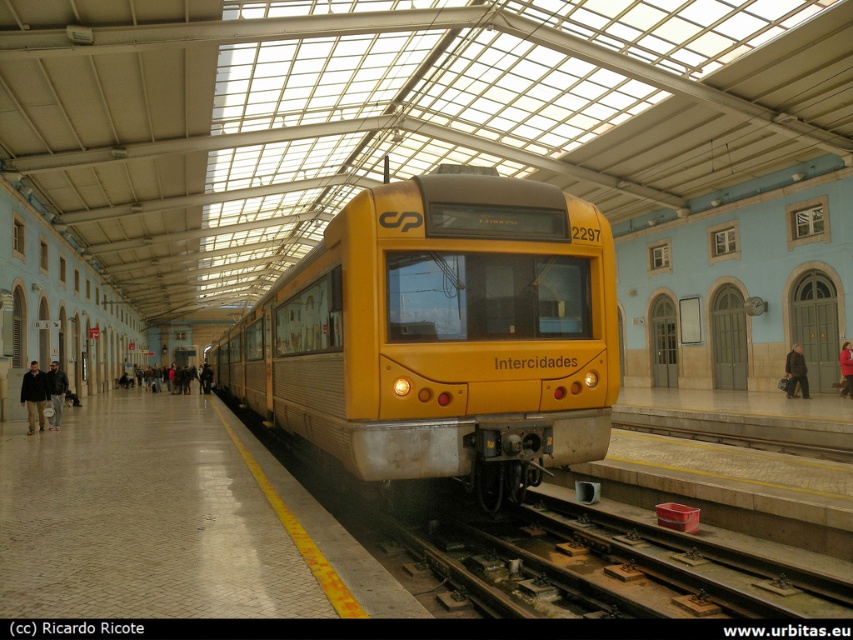
Question: Which of the following is the closest to the observer?

Choices:
 (A) smooth concrete platform at center
 (B) dark brown leather jacket at lower left

Answer: (A)

Question: Where is smooth concrete platform at center located in relation to dark brown leather coat at right in the image?

Choices:
 (A) below
 (B) above

Answer: (A)

Question: Considering the real-world distances, which object is closest to the smooth concrete platform at center?

Choices:
 (A) dark brown leather jacket at lower left
 (B) dark gray jacket at left
 (C) red wool coat at right
 (D) metallic track at center

Answer: (A)

Question: Can you confirm if metallic track at center is positioned to the right of red wool coat at right?

Choices:
 (A) no
 (B) yes

Answer: (A)

Question: Considering the real-world distances, which object is farthest from the smooth concrete platform at center?

Choices:
 (A) dark brown leather jacket at lower left
 (B) dark gray jacket at left
 (C) yellow matte train at center

Answer: (B)

Question: In this image, where is smooth concrete platform at center located relative to dark gray jacket at left?

Choices:
 (A) left
 (B) right

Answer: (B)